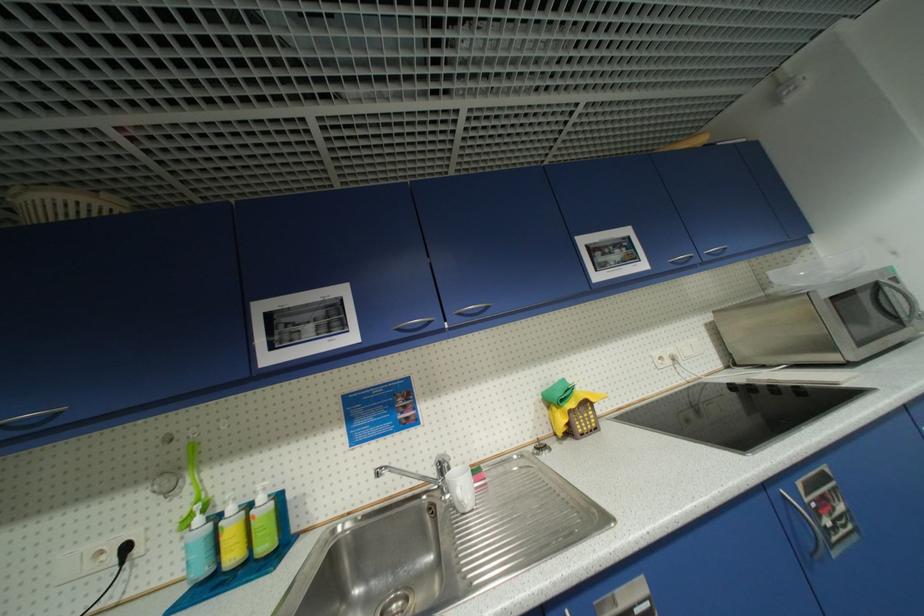
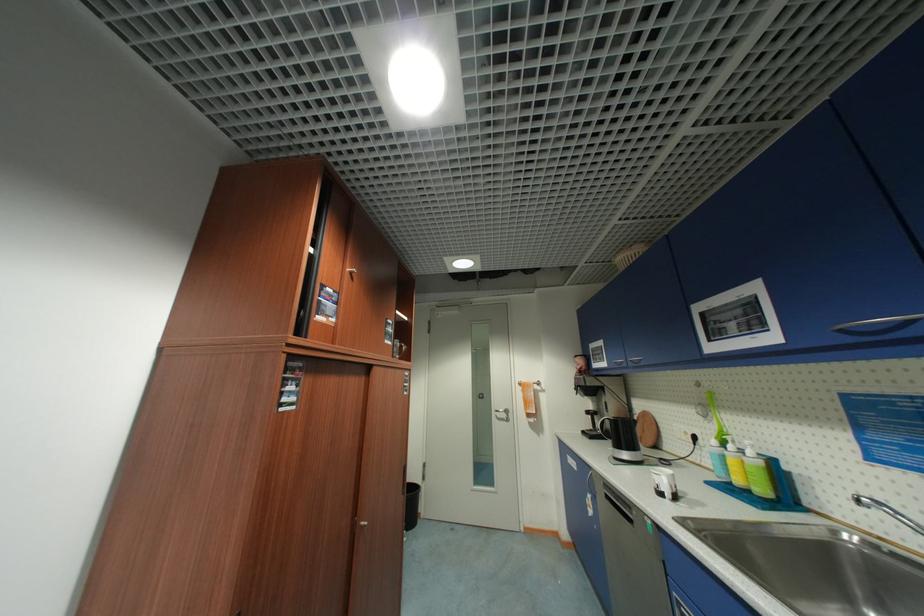
Question: The camera is either moving clockwise (left) or counter-clockwise (right) around the object. The first image is from the beginning of the video and the second image is from the end. Is the camera moving left or right when shooting the video?

Choices:
 (A) Left
 (B) Right

Answer: (B)